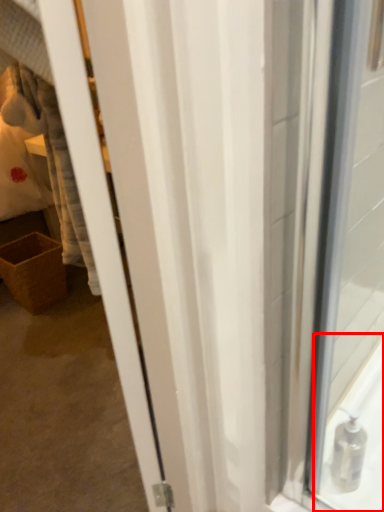
Question: From the image's perspective, considering the relative positions of bath (annotated by the red box) and basket in the image provided, where is bath (annotated by the red box) located with respect to the staircase?

Choices:
 (A) below
 (B) above

Answer: (A)